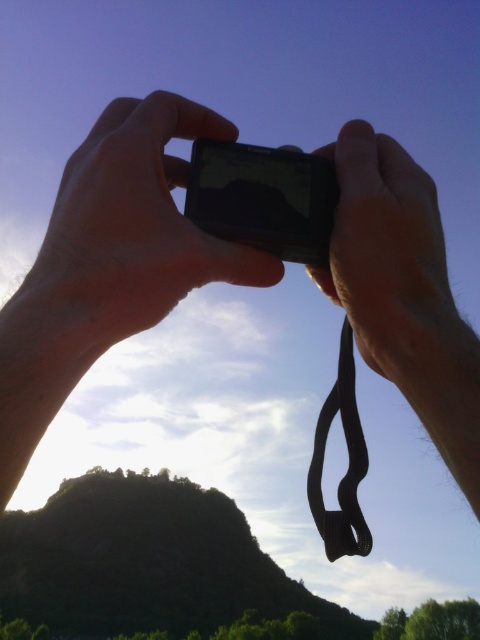
Question: Can you confirm if matte black camera at center is positioned to the right of black matte camera at center?

Choices:
 (A) no
 (B) yes

Answer: (A)

Question: Among these objects, which one is nearest to the camera?

Choices:
 (A) black rubber strap at center
 (B) matte black camera at center
 (C) black matte camera at center
 (D) black glossy smartphone at center

Answer: (B)

Question: Can you confirm if matte black camera at center is positioned below black rubber strap at center?

Choices:
 (A) yes
 (B) no

Answer: (B)

Question: Which object is farther from the camera taking this photo?

Choices:
 (A) black matte camera at center
 (B) black glossy smartphone at center

Answer: (B)

Question: Can you confirm if black glossy smartphone at center is bigger than black rubber strap at center?

Choices:
 (A) no
 (B) yes

Answer: (A)

Question: Which point is closer to the camera?

Choices:
 (A) black glossy smartphone at center
 (B) black matte camera at center
 (C) black rubber strap at center
 (D) matte black camera at center

Answer: (D)